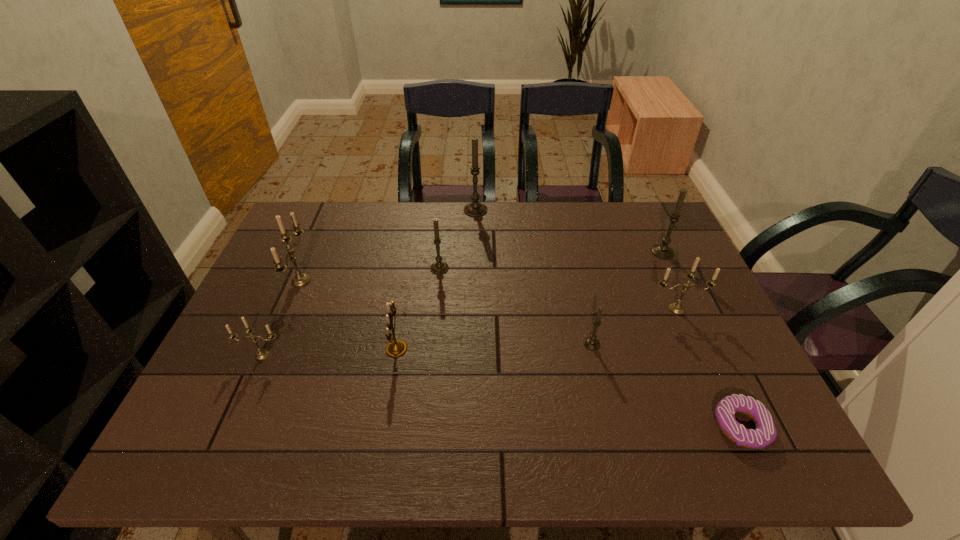
The height and width of the screenshot is (540, 960). What are the coordinates of `blank space at the left edge` in the screenshot? It's located at (260, 399).

The width and height of the screenshot is (960, 540). Find the location of `free spot at the right edge of the desktop`. free spot at the right edge of the desktop is located at coordinates (637, 252).

The height and width of the screenshot is (540, 960). I want to click on free space at the far left corner of the desktop, so click(x=289, y=226).

The height and width of the screenshot is (540, 960). I want to click on vacant space at the near left corner of the desktop, so click(x=245, y=449).

I want to click on free space at the far right corner, so click(x=682, y=242).

Locate an element on the screen. The width and height of the screenshot is (960, 540). vacant area that lies between the shortest object and the candelabrum is located at coordinates (568, 387).

At what (x,y) coordinates should I click in order to perform the action: click on free space between the biggest metallic candle and the nearest gray candle. Please return your answer as a coordinate pair (x, y). This screenshot has height=540, width=960. Looking at the image, I should click on (446, 312).

Locate an element on the screen. The height and width of the screenshot is (540, 960). vacant point located between the biggest metallic candle and the rightmost metallic candle is located at coordinates (489, 295).

Where is `free space that is in between the candelabrum and the nearest metallic candle`? free space that is in between the candelabrum and the nearest metallic candle is located at coordinates (329, 352).

You are a GUI agent. You are given a task and a screenshot of the screen. Output one action in this format:
    pyautogui.click(x=<x>, y=<y>)
    Task: Click on the free space between the third candle from right to left and the second biggest metallic candle
    The width and height of the screenshot is (960, 540).
    Given the screenshot: What is the action you would take?
    pyautogui.click(x=635, y=326)